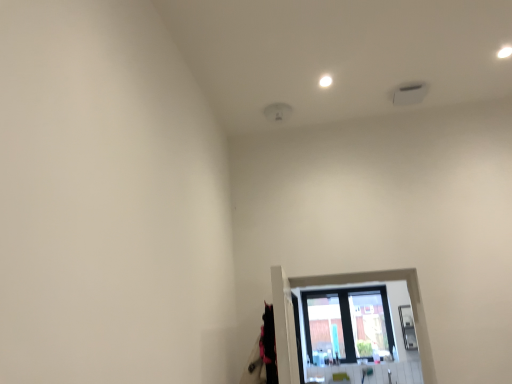
The width and height of the screenshot is (512, 384). Find the location of `transparent glass window at lower center`. transparent glass window at lower center is located at coordinates (347, 323).

What do you see at coordinates (347, 323) in the screenshot?
I see `transparent glass window at lower center` at bounding box center [347, 323].

You are a GUI agent. You are given a task and a screenshot of the screen. Output one action in this format:
    pyautogui.click(x=<x>, y=<y>)
    Task: Click on the transparent glass window at lower center
    This screenshot has height=384, width=512.
    Given the screenshot: What is the action you would take?
    pyautogui.click(x=347, y=323)